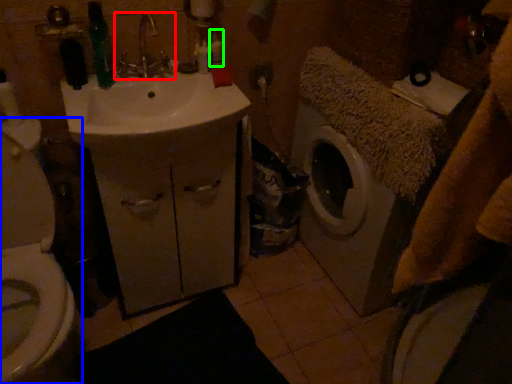
Question: Estimate the real-world distances between objects in this image. Which object is farther from tap (highlighted by a red box), toilet (highlighted by a blue box) or toiletry (highlighted by a green box)?

Choices:
 (A) toilet
 (B) toiletry

Answer: (A)